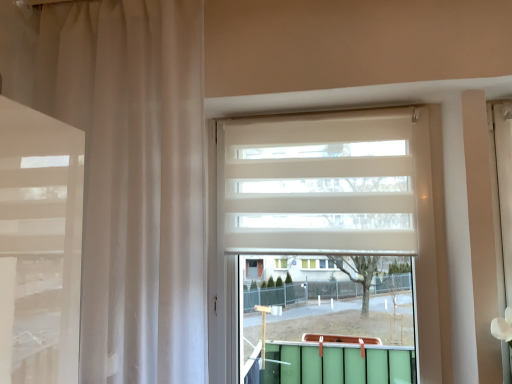
Question: Considering the relative sizes of sheer white curtain at left and white matte window at center in the image provided, is sheer white curtain at left thinner than white matte window at center?

Choices:
 (A) no
 (B) yes

Answer: (A)

Question: Is sheer white curtain at left facing away from white matte window at center?

Choices:
 (A) no
 (B) yes

Answer: (A)

Question: From the image's perspective, is sheer white curtain at left on top of white matte window at center?

Choices:
 (A) yes
 (B) no

Answer: (A)

Question: Is sheer white curtain at left outside white matte window at center?

Choices:
 (A) yes
 (B) no

Answer: (A)

Question: Is sheer white curtain at left next to white matte window at center?

Choices:
 (A) yes
 (B) no

Answer: (B)

Question: From the image's perspective, is white matte blind at center above or below sheer white curtain at left?

Choices:
 (A) below
 (B) above

Answer: (B)

Question: In terms of width, does white matte blind at center look wider or thinner when compared to sheer white curtain at left?

Choices:
 (A) thin
 (B) wide

Answer: (A)

Question: From a real-world perspective, is white matte blind at center positioned above or below sheer white curtain at left?

Choices:
 (A) above
 (B) below

Answer: (A)

Question: Considering the positions of white matte blind at center and sheer white curtain at left in the image, is white matte blind at center taller or shorter than sheer white curtain at left?

Choices:
 (A) short
 (B) tall

Answer: (A)

Question: Is white matte window at center spatially inside white matte blind at center, or outside of it?

Choices:
 (A) outside
 (B) inside

Answer: (B)

Question: From a real-world perspective, is white matte window at center above or below white matte blind at center?

Choices:
 (A) above
 (B) below

Answer: (B)

Question: Is white matte window at center in front of or behind white matte blind at center in the image?

Choices:
 (A) behind
 (B) front

Answer: (B)

Question: In terms of width, does white matte window at center look wider or thinner when compared to white matte blind at center?

Choices:
 (A) thin
 (B) wide

Answer: (B)

Question: Considering their positions, is white matte window at center located in front of or behind sheer white curtain at left?

Choices:
 (A) front
 (B) behind

Answer: (B)

Question: From a real-world perspective, is white matte window at center physically located above or below sheer white curtain at left?

Choices:
 (A) above
 (B) below

Answer: (B)